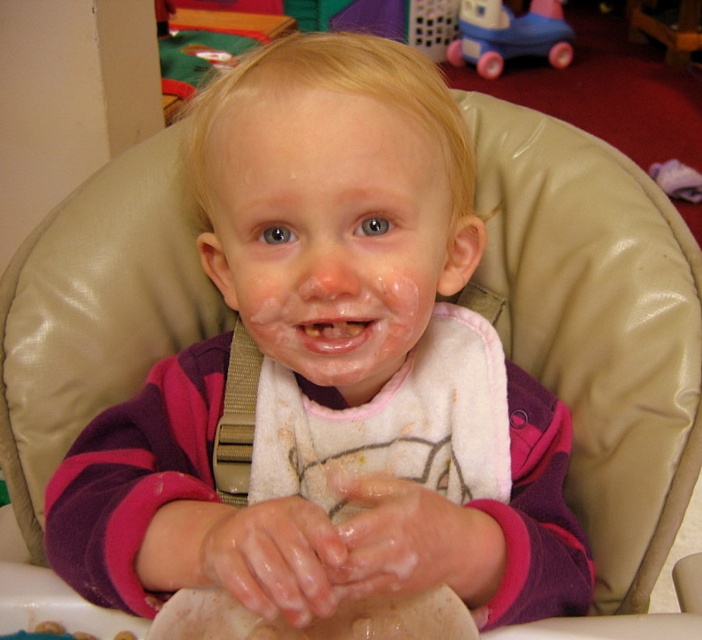
Question: Is pink fleece sweater at center thinner than matte plastic toy car at upper right?

Choices:
 (A) yes
 (B) no

Answer: (A)

Question: Which of the following is the farthest from the observer?

Choices:
 (A) pos(390,328)
 (B) pos(571,32)

Answer: (B)

Question: Does pink fleece sweater at center have a smaller size compared to yellowish matte teeth at center?

Choices:
 (A) no
 (B) yes

Answer: (A)

Question: Where is pink fleece sweater at center located in relation to yellowish matte teeth at center in the image?

Choices:
 (A) right
 (B) left

Answer: (B)

Question: Which point is closer to the camera?

Choices:
 (A) white matte bib at center
 (B) matte plastic toy car at upper right
 (C) pink fleece sweater at center
 (D) yellowish matte teeth at center

Answer: (C)

Question: Which point is closer to the camera?

Choices:
 (A) (482, 17)
 (B) (324, 349)
 (C) (463, 282)

Answer: (B)